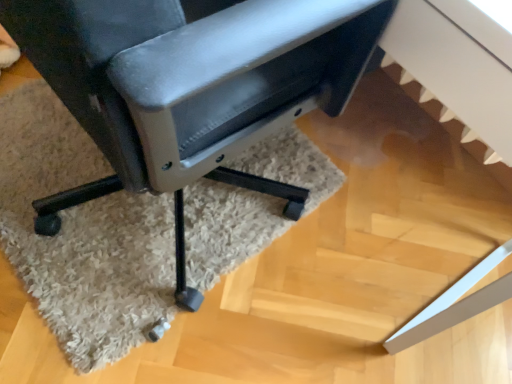
Find the location of a particular element. The image size is (512, 384). vacant area on top of beige shaggy rug at lower center (from a real-world perspective) is located at coordinates (131, 216).